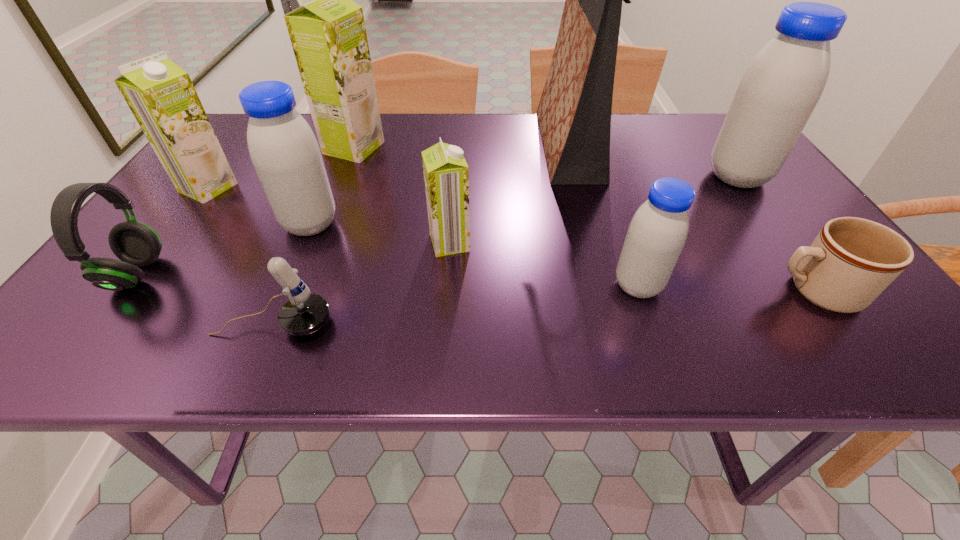
Where is `free spot at the near edge of the desktop`? free spot at the near edge of the desktop is located at coordinates (636, 354).

Find the location of a particular element. This screenshot has width=960, height=540. free spot at the right edge of the desktop is located at coordinates (774, 260).

Locate an element on the screen. The image size is (960, 540). free space at the far left corner of the desktop is located at coordinates (236, 121).

Find the location of a particular element. blank space at the far right corner is located at coordinates (719, 120).

The width and height of the screenshot is (960, 540). In order to click on vacant space at the near right corner of the desktop in this screenshot , I will do `click(850, 346)`.

Identify the location of vacant area that lies between the brown mug and the second biggest green soya milk. Image resolution: width=960 pixels, height=540 pixels. (512, 240).

The image size is (960, 540). Find the location of `blank region between the headset and the mug`. blank region between the headset and the mug is located at coordinates (476, 282).

Image resolution: width=960 pixels, height=540 pixels. What are the coordinates of `empty location between the second green soya milk from right to left and the leftmost blue soya milk` in the screenshot? It's located at (332, 186).

Find the location of a particular element. This screenshot has height=540, width=960. vacant area that lies between the tallest object and the black headset is located at coordinates (351, 210).

Identify the location of vacant space that is in between the ninth tallest object and the black headset. The image size is (960, 540). (205, 299).